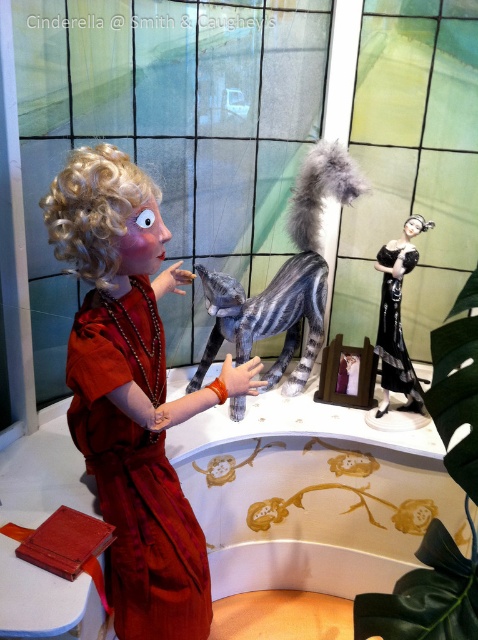
You are a costume designer examining the display and need to determine the arrangement of the dresses. Which dress is positioned lower in the scene, the matte red dress at center or the black satin dress at center?

The matte red dress at center is positioned below the black satin dress at center, so it is lower in the scene.